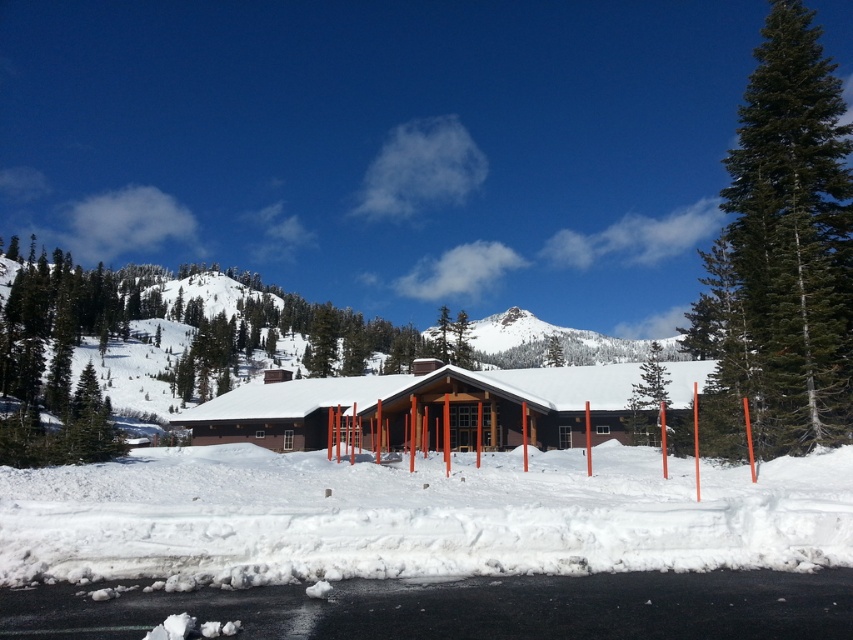
You are standing at the entrance of the brown wooden cabin at center. If you walk straight ahead, which direction will you face relative to the orange poles?

Since the brown wooden cabin at center is located at point (x=426, y=406), walking straight ahead from the entrance would face you towards the orange poles positioned in front of the building.

You are planning to place a new bench in the winter landscape scene. The bench requires a space wider than the green textured pine tree at center. Can the area in front of the brown wooden cabin at center accommodate this bench?

The brown wooden cabin at center might be wider than green textured pine tree at center, so it is possible that the area in front of the brown wooden cabin at center is wide enough to accommodate the bench.